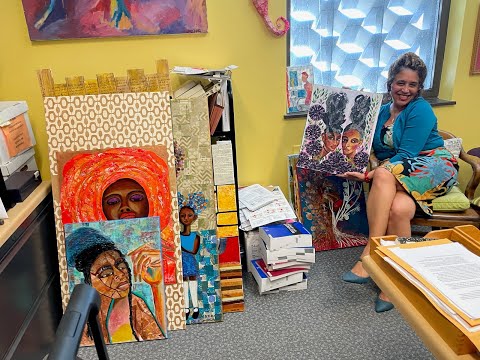
You are a GUI agent. You are given a task and a screenshot of the screen. Output one action in this format:
    pyautogui.click(x=<x>, y=<y>)
    Task: Click on the painting of woman
    Image resolution: width=480 pixels, height=360 pixels.
    Given the screenshot: What is the action you would take?
    pyautogui.click(x=118, y=183)